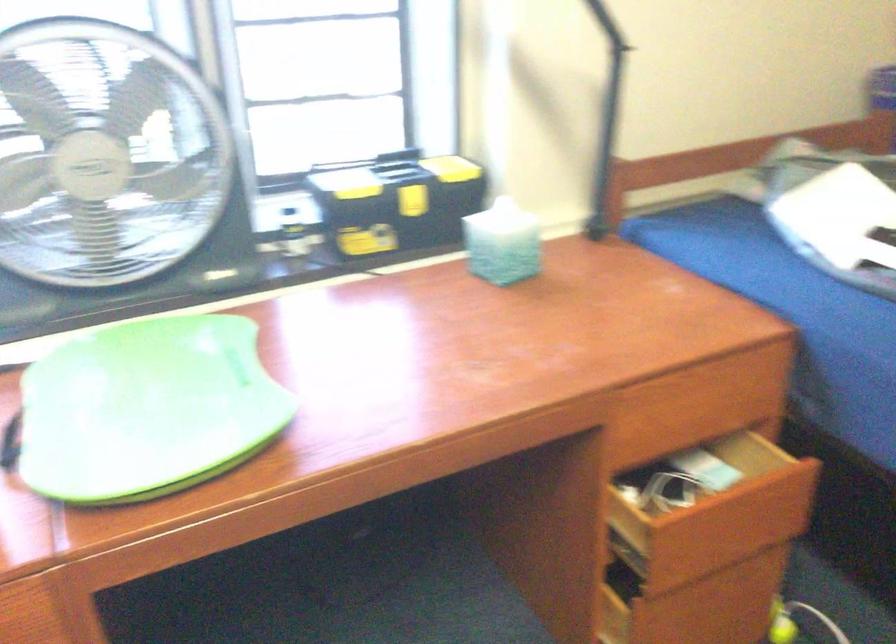
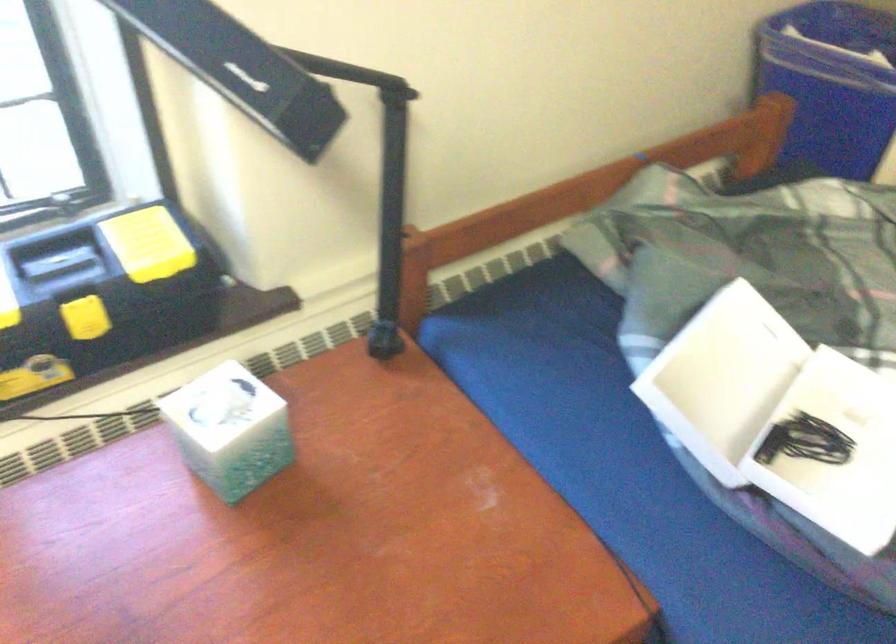
Question: The first image is from the beginning of the video and the second image is from the end. How did the camera likely rotate when shooting the video?

Choices:
 (A) Left
 (B) Right
 (C) Up
 (D) Down

Answer: (D)